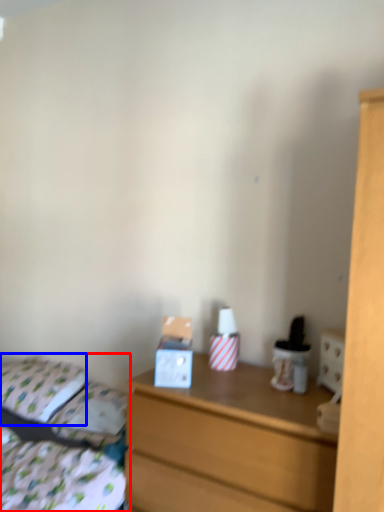
Question: Which object appears farthest to the camera in this image, bed (highlighted by a red box) or pillow (highlighted by a blue box)?

Choices:
 (A) bed
 (B) pillow

Answer: (B)